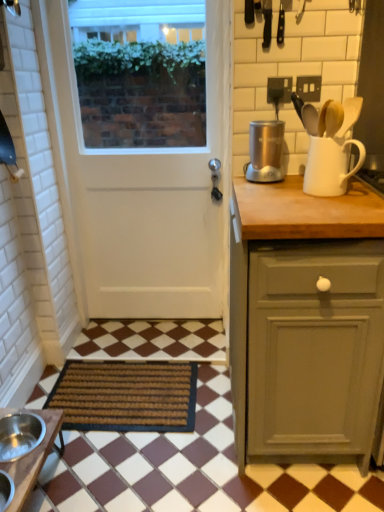
Image resolution: width=384 pixels, height=512 pixels. In order to click on vacant space situated on the left part of white matte jug at upper right in this screenshot , I will do `click(270, 189)`.